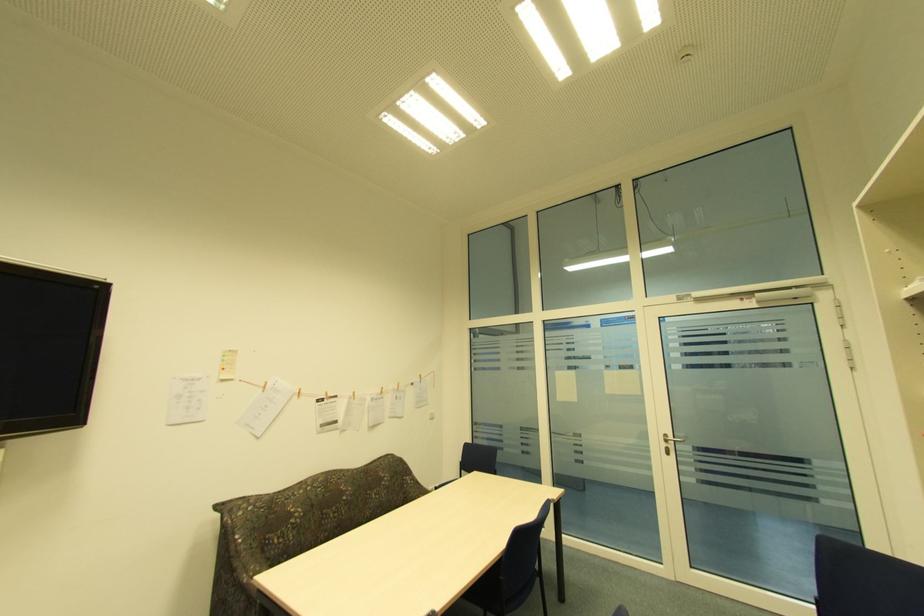
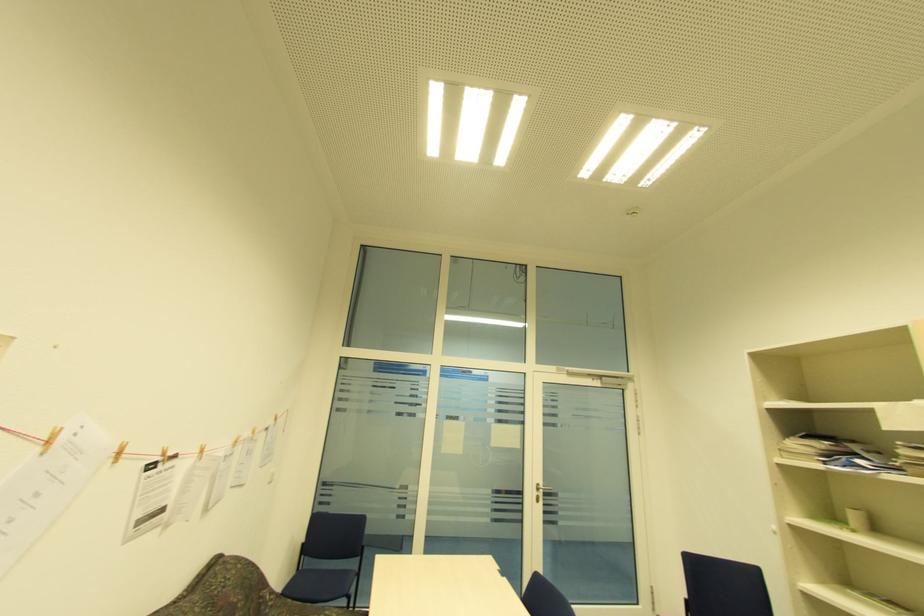
Locate, in the second image, the point that corresponds to point 357,395 in the first image.

(203, 453)